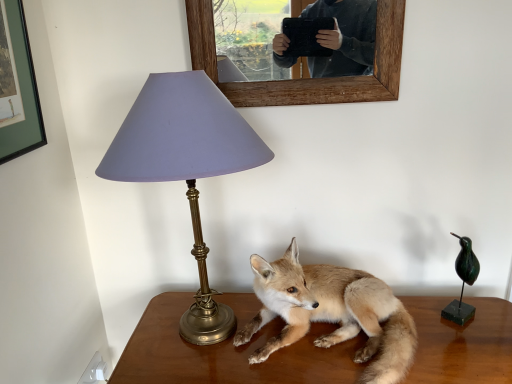
In order to click on free spot below matte purple shade at left (from a real-world perspective) in this screenshot , I will do `click(194, 344)`.